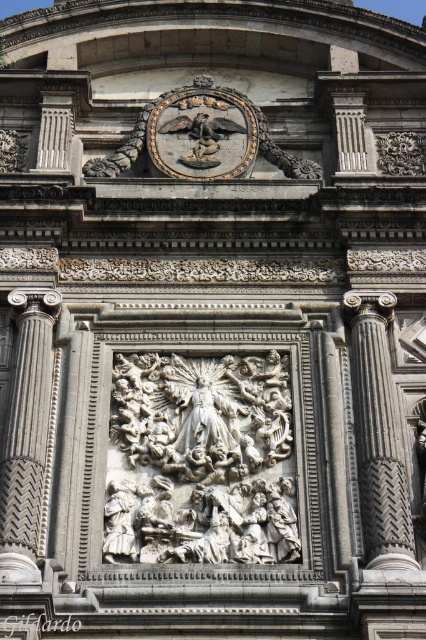
Question: Which point is closer to the camera?

Choices:
 (A) (8, 424)
 (B) (359, 356)

Answer: (A)

Question: Observing the image, what is the correct spatial positioning of gold metallic angel at upper center in reference to gray stone column at left?

Choices:
 (A) right
 (B) left

Answer: (A)

Question: Which object appears closest to the camera in this image?

Choices:
 (A) gray stone column at left
 (B) gold metallic angel at upper center

Answer: (A)

Question: Can you confirm if gold metallic angel at upper center is wider than gray stone column at left?

Choices:
 (A) yes
 (B) no

Answer: (A)

Question: Does gold metallic angel at upper center have a greater width compared to gray stone column at left?

Choices:
 (A) no
 (B) yes

Answer: (B)

Question: Which object is positioned farthest from the gray textured column at center-right?

Choices:
 (A) gold metallic angel at upper center
 (B) gray stone column at left
 (C) white marble sculpture at center

Answer: (A)